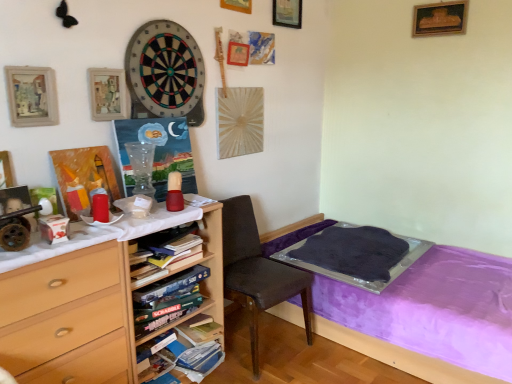
Question: From a real-world perspective, relative to matte white box at left, is matte wooden picture frame at upper left, the second picture frame when ordered from bottom to top, vertically above or below?

Choices:
 (A) above
 (B) below

Answer: (A)

Question: Relative to matte white box at left, is matte wooden picture frame at upper left, the second picture frame when ordered from left to right, in front or behind?

Choices:
 (A) front
 (B) behind

Answer: (B)

Question: Which of these objects is positioned closest to the wooden picture frame at upper left, placed as the 1th picture frame when sorted from left to right?

Choices:
 (A) brown fabric chair at center
 (B) hardcover book at center, which is counted as the second book, starting from the top
 (C) hardcover book at center, positioned as the 1th book in top-to-bottom order
 (D) soft felt dartboard at upper center
 (E) wooden desk at left

Answer: (D)

Question: Estimate the real-world distances between objects in this image. Which object is closer to the hardcover book at center, the second book when ordered from bottom to top?

Choices:
 (A) matte wooden picture frame at upper left, the 4th picture frame in the right-to-left sequence
 (B) matte red bottle at center
 (C) wooden picture frame at upper center, which appears as the 3th picture frame when viewed from the front
 (D) purple fabric bed at lower right
 (E) hardcover book at center, which is counted as the second book, starting from the top

Answer: (E)